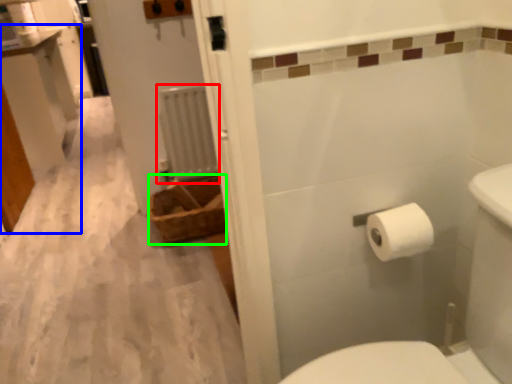
Question: Which is farther away from radiator (highlighted by a red box)? vanity (highlighted by a blue box) or basket (highlighted by a green box)?

Choices:
 (A) vanity
 (B) basket

Answer: (A)